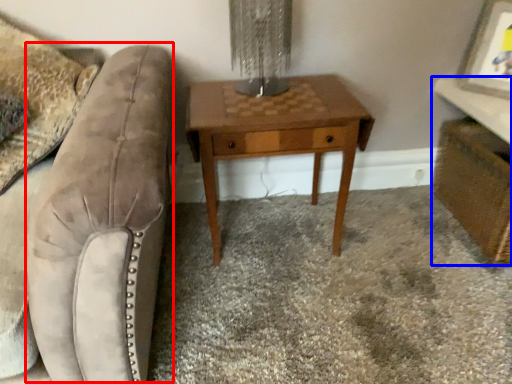
Question: Which point is closer to the camera, swivel chair (highlighted by a red box) or vanity (highlighted by a blue box)?

Choices:
 (A) swivel chair
 (B) vanity

Answer: (A)